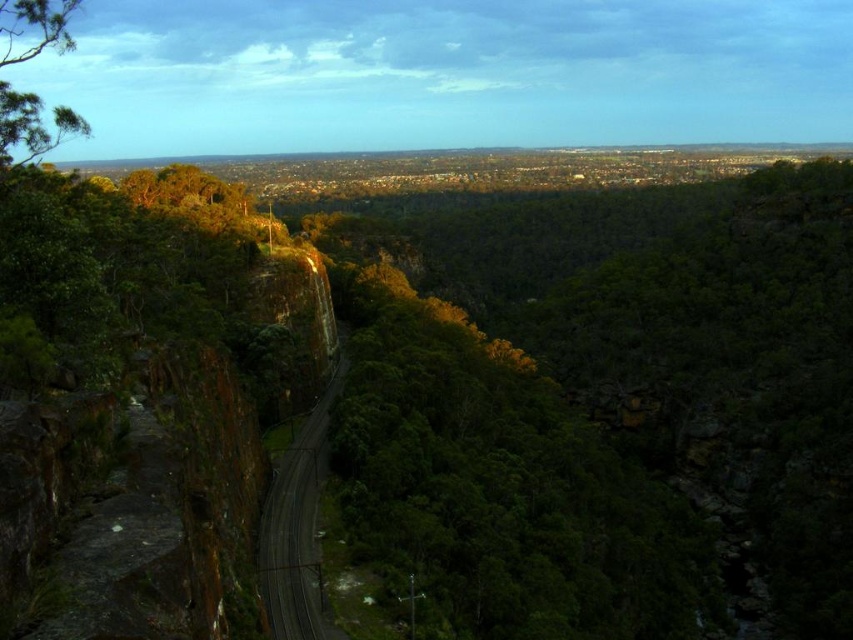
Does green leafy tree at center have a greater width compared to green leafy tree at upper left?

Yes, green leafy tree at center is wider than green leafy tree at upper left.

The height and width of the screenshot is (640, 853). I want to click on green leafy tree at center, so click(x=604, y=406).

This screenshot has height=640, width=853. Find the location of `green leafy tree at center`. green leafy tree at center is located at coordinates [x=604, y=406].